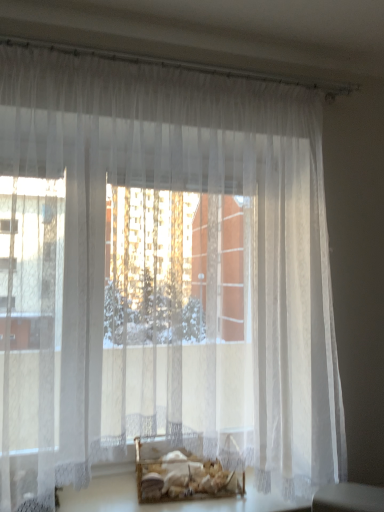
Question: From the image's perspective, is translucent glass table at lower center positioned above or below wooden crate at center?

Choices:
 (A) above
 (B) below

Answer: (B)

Question: From a real-world perspective, is translucent glass table at lower center physically located above or below wooden crate at center?

Choices:
 (A) below
 (B) above

Answer: (A)

Question: Is translucent glass table at lower center wider or thinner than wooden crate at center?

Choices:
 (A) wide
 (B) thin

Answer: (A)

Question: In the image, is wooden crate at center on the left side or the right side of translucent glass table at lower center?

Choices:
 (A) left
 (B) right

Answer: (A)

Question: Is point (200, 478) positioned closer to the camera than point (99, 486)?

Choices:
 (A) farther
 (B) closer

Answer: (B)

Question: Based on their sizes in the image, would you say wooden crate at center is bigger or smaller than translucent glass table at lower center?

Choices:
 (A) big
 (B) small

Answer: (B)

Question: From the image's perspective, relative to translucent glass table at lower center, is wooden crate at center above or below?

Choices:
 (A) above
 (B) below

Answer: (A)